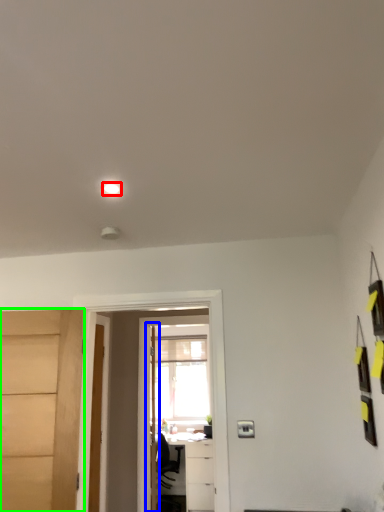
Question: Estimate the real-world distances between objects in this image. Which object is farther from light (highlighted by a red box), door (highlighted by a blue box) or door (highlighted by a green box)?

Choices:
 (A) door
 (B) door

Answer: (A)